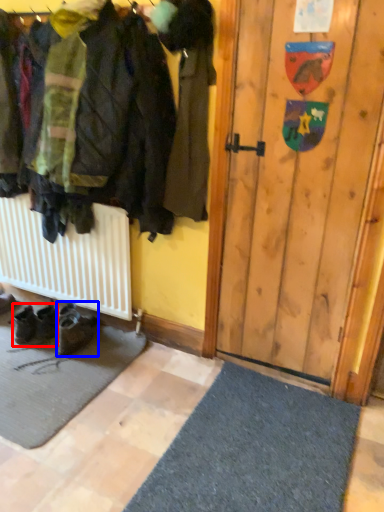
Question: Which object appears closest to the camera in this image, footwear (highlighted by a red box) or footwear (highlighted by a blue box)?

Choices:
 (A) footwear
 (B) footwear

Answer: (B)